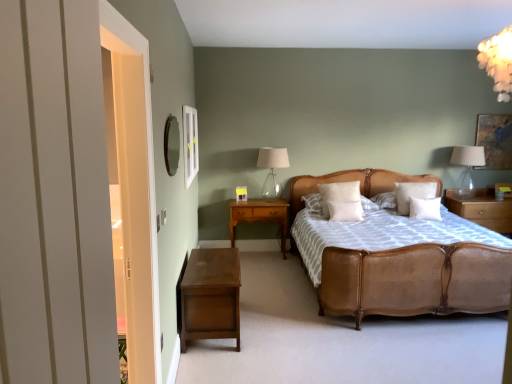
Find the location of a particular element. The image size is (512, 384). vacant area that is situated to the right of dark brown wood nightstand at lower left, the first nightstand viewed from the front is located at coordinates (281, 326).